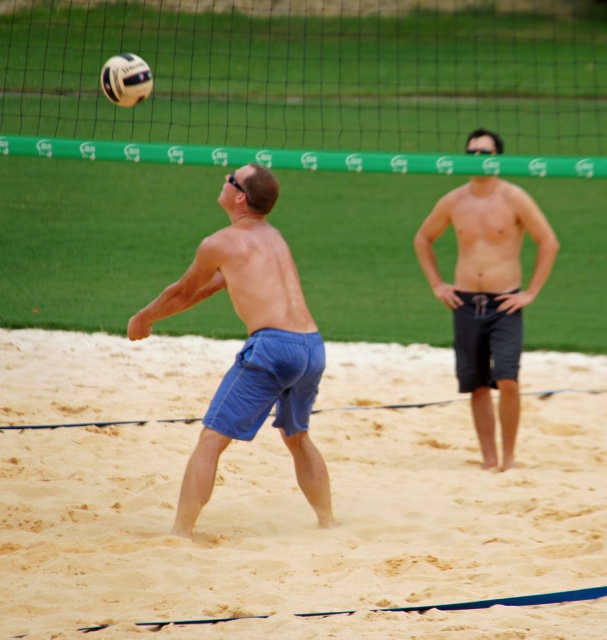
You are a photographer positioned at the edge of the volleyball court. You want to take a photo of both the green fabric net at upper center and the dark gray shorts at center. Which object should you focus on first to ensure both are in focus?

You should focus on the dark gray shorts at center first because it is closer to you than the green fabric net at upper center, which is further away. By focusing on the closer object, the net will still be within the depth of field.

What is the coordinate of the green fabric net at upper center?

The green fabric net at upper center is located at coordinate point (311,83).